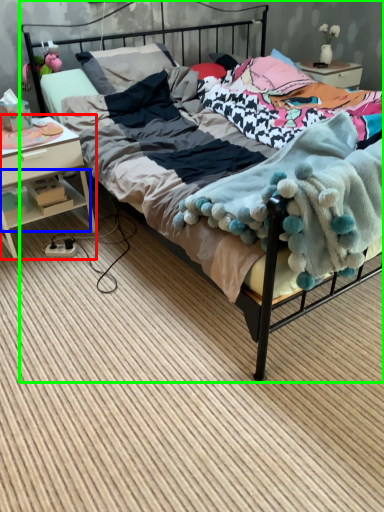
Question: Considering the real-world distances, which object is farthest from nightstand (highlighted by a red box)? shelf (highlighted by a blue box) or bed (highlighted by a green box)?

Choices:
 (A) shelf
 (B) bed

Answer: (B)